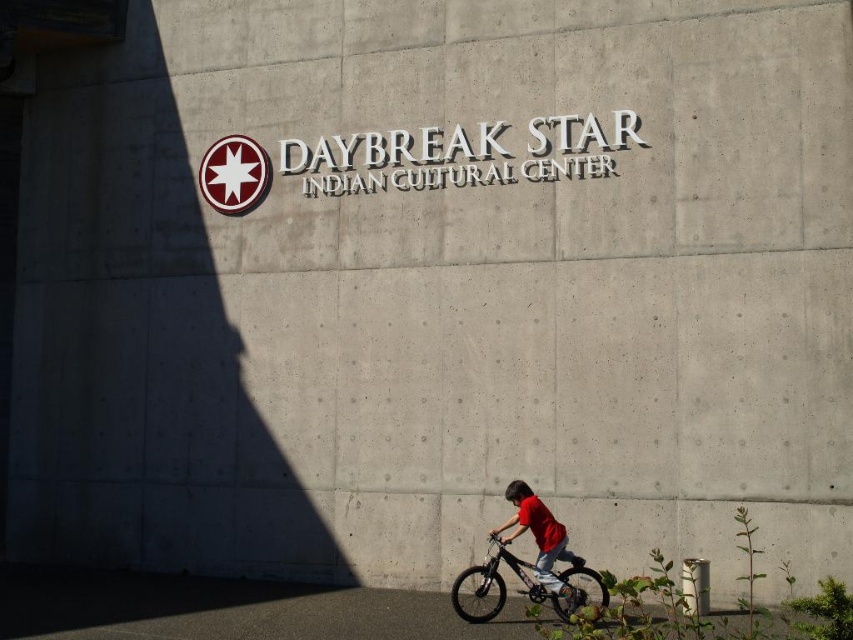
You are a visitor arriving at the Daybreak Star Indian Cultural Center and notice a child in the foreground. Where is the black matte bicycle at lower right in relation to the matte red shirt at lower right?

The black matte bicycle at lower right is below the matte red shirt at lower right.

You are a photographer standing in front of the Daybreak Star Indian Cultural Center. You want to take a photo that includes both the black matte bicycle at lower right and the matte red shirt at lower right. Which object should you focus on first to ensure both are in sharp focus?

Since the black matte bicycle at lower right is closer to the viewer than the matte red shirt at lower right, you should focus on the black matte bicycle at lower right first. This ensures that both objects will be in sharp focus as the matte red shirt at lower right is further away.

Looking at this image, you are standing at the entrance of the DAYBREAK STAR INDIAN CULTURAL CENTER and want to find the black matte bicycle at lower right. According to the coordinates provided, where should you look relative to the building?

The black matte bicycle at lower right is located at coordinates point (523, 582), which means it is positioned towards the lower right area relative to the building.